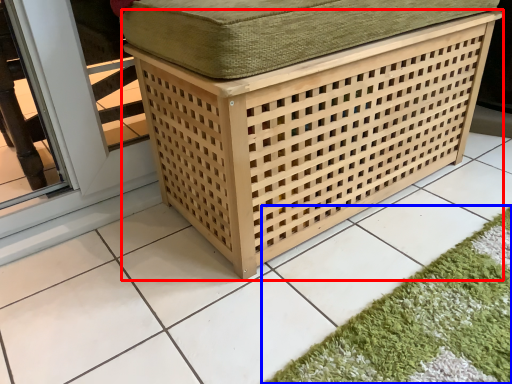
Question: Which object appears closest to the camera in this image, furniture (highlighted by a red box) or bath mat (highlighted by a blue box)?

Choices:
 (A) furniture
 (B) bath mat

Answer: (B)